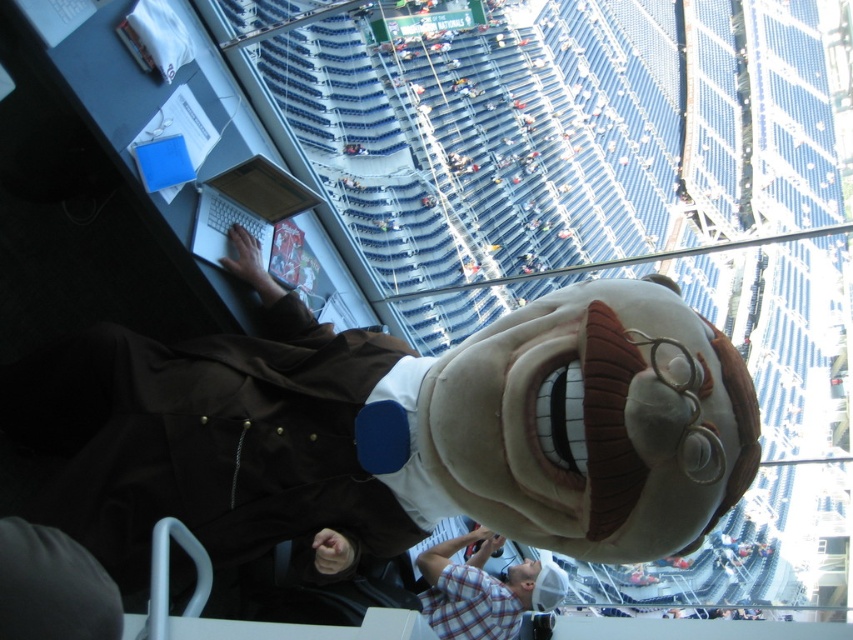
Question: Which of the following is the farthest from the observer?

Choices:
 (A) brown plush mascot at center
 (B) plaid shirt at lower center

Answer: (B)

Question: Can you confirm if brown plush mascot at center is positioned below plaid shirt at lower center?

Choices:
 (A) yes
 (B) no

Answer: (B)

Question: Does brown plush mascot at center appear on the left side of plaid shirt at lower center?

Choices:
 (A) yes
 (B) no

Answer: (A)

Question: Is brown plush mascot at center positioned at the back of plaid shirt at lower center?

Choices:
 (A) no
 (B) yes

Answer: (A)

Question: Which of the following is the farthest from the observer?

Choices:
 (A) plaid shirt at lower center
 (B) brown plush mascot at center

Answer: (A)